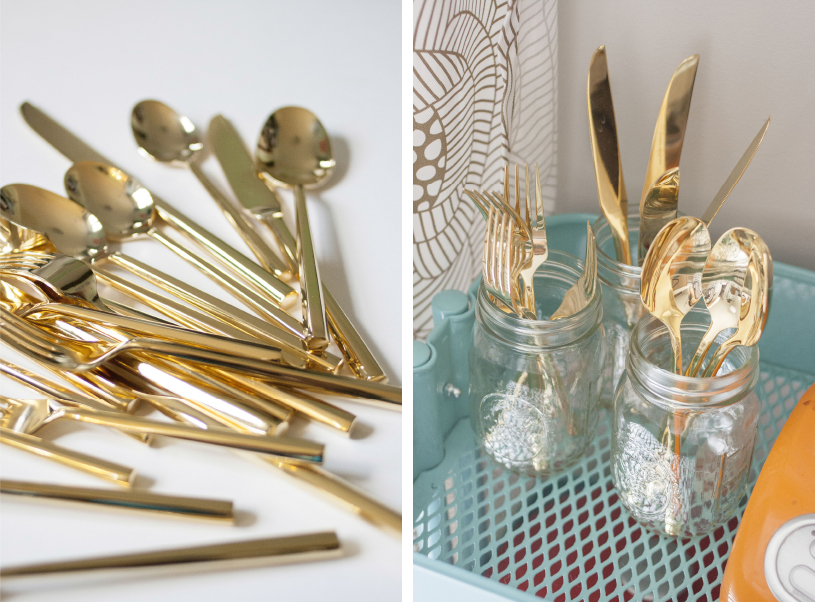
Locate an element on the screen. The width and height of the screenshot is (815, 603). curtain is located at coordinates (455, 77).